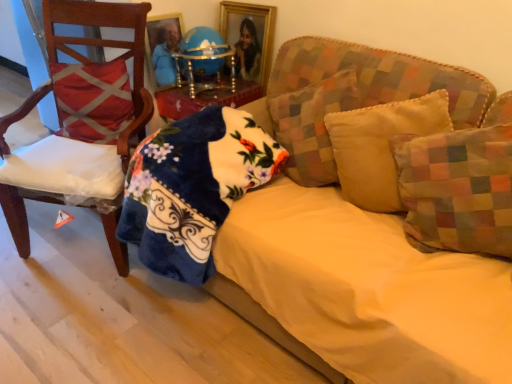
Question: From a real-world perspective, is multicolored fabric pillow at right, the fourth pillow positioned from the left, above or below blue glossy globe at center?

Choices:
 (A) below
 (B) above

Answer: (A)

Question: Based on their positions, is multicolored fabric pillow at right, which is the first pillow from right to left, located to the left or right of blue glossy globe at center?

Choices:
 (A) left
 (B) right

Answer: (B)

Question: Based on their relative distances, which object is farther from the wooden chair at left?

Choices:
 (A) yellow fabric pillow at center, arranged as the 2th pillow when viewed from the right
 (B) multicolored fabric pillow at right, which is the first pillow from right to left
 (C) velvet yellow couch at center
 (D) blue glossy globe at center
 (E) beige fabric pillow at center, which is the 2th pillow in left-to-right order

Answer: (B)

Question: Which of these objects is positioned closest to the red fabric pillow at left, which is the 4th pillow in right-to-left order?

Choices:
 (A) yellow fabric pillow at center, arranged as the third pillow when viewed from the left
 (B) gold/glass picture frame at upper center
 (C) fluffy blue blanket at lower left
 (D) beige fabric pillow at center, which is the 2th pillow in left-to-right order
 (E) blue glossy globe at center

Answer: (E)